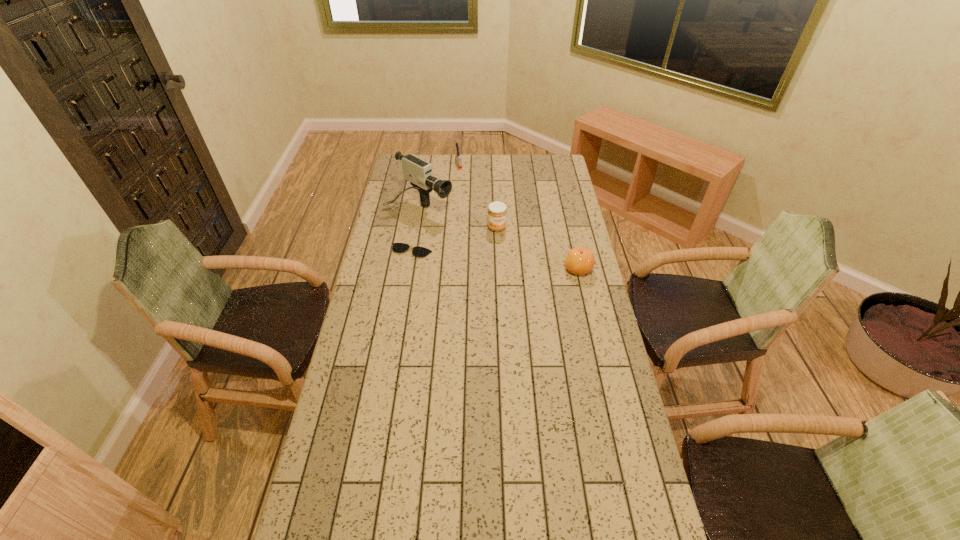
This screenshot has width=960, height=540. I want to click on free spot between the shortest object and the second tallest object, so click(454, 239).

In order to click on free spot between the rightmost object and the second tallest object in this screenshot , I will do [538, 248].

Where is `vacant space that's between the farthest object and the rightmost object`? The width and height of the screenshot is (960, 540). vacant space that's between the farthest object and the rightmost object is located at coordinates (x=518, y=216).

The height and width of the screenshot is (540, 960). Find the location of `free space between the jam and the tallest object`. free space between the jam and the tallest object is located at coordinates (459, 218).

Where is `free space that is in between the camcorder and the second nearest object`? This screenshot has height=540, width=960. free space that is in between the camcorder and the second nearest object is located at coordinates (416, 229).

What are the coordinates of `vacant space in between the clementine and the fourth shortest object` in the screenshot? It's located at (538, 248).

Find the location of a particular element. the second closest object to the spectacles is located at coordinates (497, 212).

This screenshot has height=540, width=960. Find the location of `the third closest object to the tallest object`. the third closest object to the tallest object is located at coordinates (458, 157).